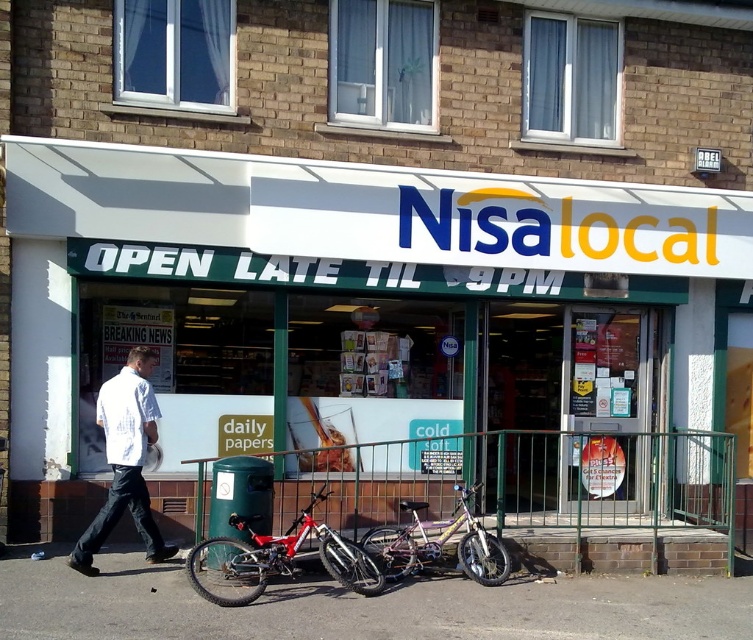
Does white plastic signboard at upper center have a smaller size compared to metallic silver bicycle at center?

Indeed, white plastic signboard at upper center has a smaller size compared to metallic silver bicycle at center.

Is point (581, 188) positioned behind point (416, 515)?

Yes.

Find the location of a particular element. The width and height of the screenshot is (753, 640). white plastic signboard at upper center is located at coordinates (357, 298).

Who is taller, white shirt at center or metallic silver bicycle at center?

white shirt at center

Who is lower down, white shirt at center or metallic silver bicycle at center?

metallic silver bicycle at center is below.

What do you see at coordinates (125, 460) in the screenshot? The image size is (753, 640). I see `white shirt at center` at bounding box center [125, 460].

Find the location of a particular element. white shirt at center is located at coordinates (125, 460).

Which is in front, point (261, 209) or point (84, 536)?

Point (84, 536)

Consider the image. Does white plastic signboard at upper center have a greater width compared to white shirt at center?

Yes, white plastic signboard at upper center is wider than white shirt at center.

What do you see at coordinates (357, 298) in the screenshot?
I see `white plastic signboard at upper center` at bounding box center [357, 298].

I want to click on white plastic signboard at upper center, so click(x=357, y=298).